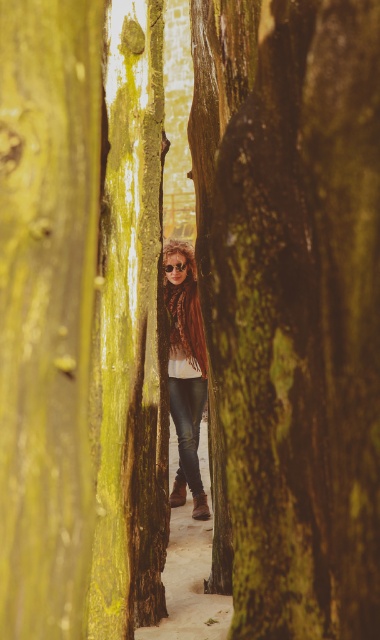
Can you confirm if green mossy tree trunk at center is bigger than shiny metallic goggles at center?

Indeed, green mossy tree trunk at center has a larger size compared to shiny metallic goggles at center.

Is green mossy tree trunk at center below shiny metallic goggles at center?

Yes, green mossy tree trunk at center is below shiny metallic goggles at center.

Is point (311, 419) closer to viewer compared to point (183, 266)?

That is True.

In order to click on green mossy tree trunk at center in this screenshot , I will do `click(302, 324)`.

Is point (362, 440) less distant than point (183, 276)?

Yes, it is.

Measure the distance between green mossy tree trunk at center and camera.

green mossy tree trunk at center is 2.82 meters from camera.

Describe the element at coordinates (302, 324) in the screenshot. I see `green mossy tree trunk at center` at that location.

Locate an element on the screen. Image resolution: width=380 pixels, height=640 pixels. green mossy tree trunk at center is located at coordinates (302, 324).

Which of these two, shiny brown hair at center or shiny metallic goggles at center, stands taller?

Standing taller between the two is shiny brown hair at center.

Which of these two, shiny brown hair at center or shiny metallic goggles at center, stands shorter?

shiny metallic goggles at center is shorter.

Is point (178, 372) positioned in front of point (177, 266)?

No, it is not.

You are a GUI agent. You are given a task and a screenshot of the screen. Output one action in this format:
    pyautogui.click(x=<x>, y=<y>)
    Task: Click on the shiny brown hair at center
    The width and height of the screenshot is (380, 640).
    Given the screenshot: What is the action you would take?
    pyautogui.click(x=185, y=372)